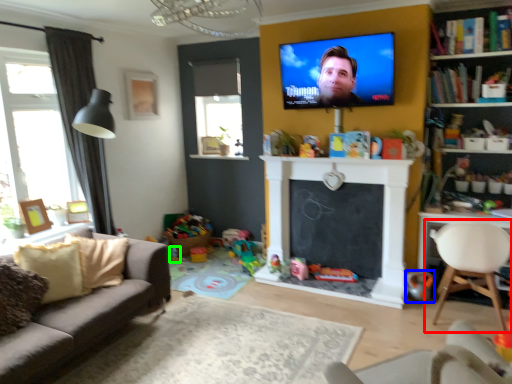
Question: Which is nearer to the chair (highlighted by a red box)? toy (highlighted by a blue box) or toy (highlighted by a green box).

Choices:
 (A) toy
 (B) toy

Answer: (A)